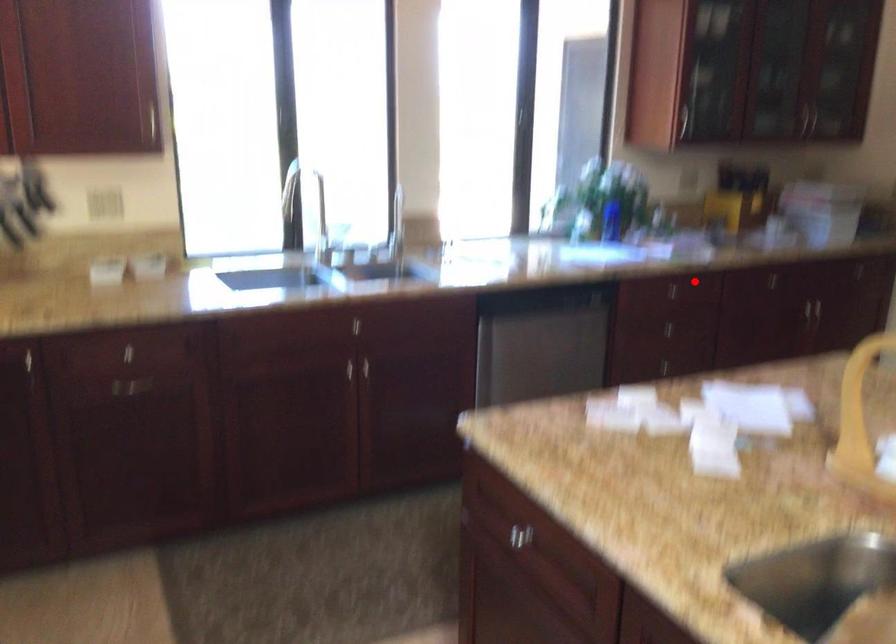
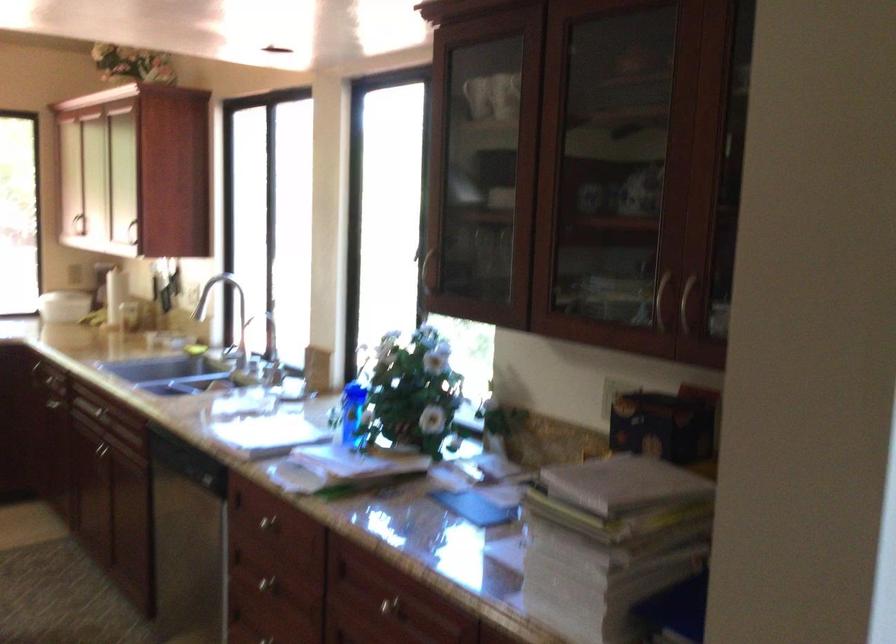
Question: I am providing you with two images of the same scene from different viewpoints. In image1, a red point is highlighted. Considering the same 3D point in image2, which of the following is correct?

Choices:
 (A) It is closer
 (B) It is farther

Answer: (A)